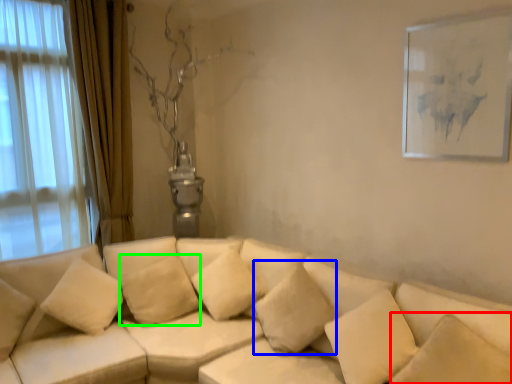
Question: Which object is positioned farthest from pillow (highlighted by a red box)? Select from pillow (highlighted by a blue box) and pillow (highlighted by a green box).

Choices:
 (A) pillow
 (B) pillow

Answer: (B)